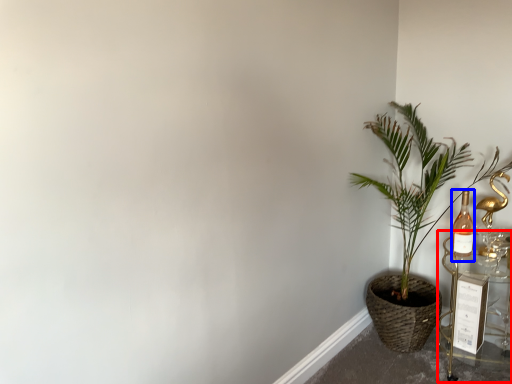
Question: Among these objects, which one is nearest to the camera, table (highlighted by a red box) or bottle (highlighted by a blue box)?

Choices:
 (A) table
 (B) bottle

Answer: (A)